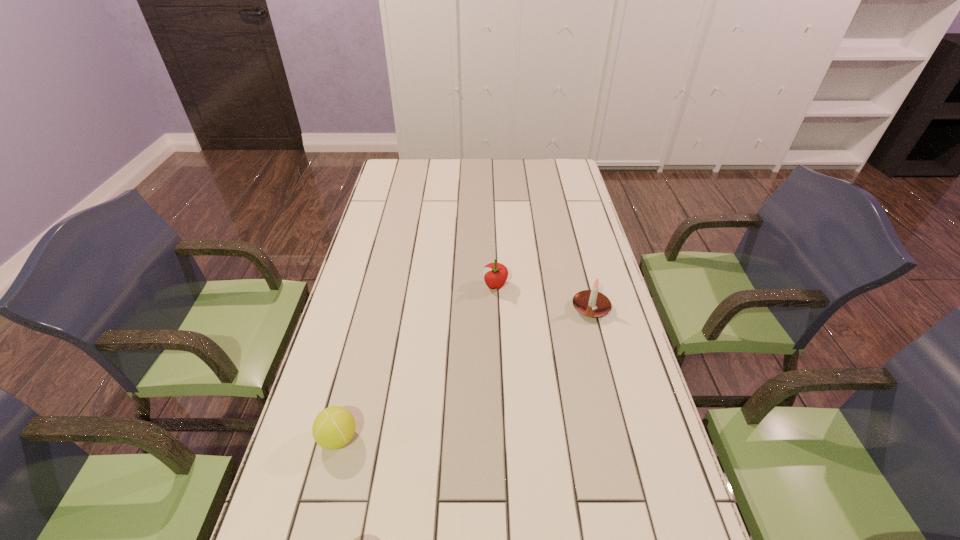
Where is `object that is at the right edge`? object that is at the right edge is located at coordinates [591, 303].

Find the location of a particular element. vacant space at the far edge of the desktop is located at coordinates (454, 164).

Locate an element on the screen. The image size is (960, 540). vacant space at the left edge is located at coordinates (392, 279).

The image size is (960, 540). I want to click on vacant region at the right edge of the desktop, so click(x=665, y=471).

I want to click on free space between the apple and the rightmost object, so click(x=543, y=297).

Find the location of a particular element. This screenshot has width=960, height=540. vacant area between the second object from right to left and the tallest object is located at coordinates (543, 297).

Image resolution: width=960 pixels, height=540 pixels. What are the coordinates of `free spot between the second object from right to left and the tallest object` in the screenshot? It's located at (543, 297).

Find the location of a particular element. Image resolution: width=960 pixels, height=540 pixels. empty location between the apple and the tallest object is located at coordinates (543, 297).

You are a GUI agent. You are given a task and a screenshot of the screen. Output one action in this format:
    pyautogui.click(x=<x>, y=<y>)
    Task: Click on the blank region between the leftmost object and the rightmost object
    This screenshot has width=960, height=540.
    Given the screenshot: What is the action you would take?
    pyautogui.click(x=465, y=373)

This screenshot has height=540, width=960. Identify the location of free spot between the nearest object and the apple. (417, 362).